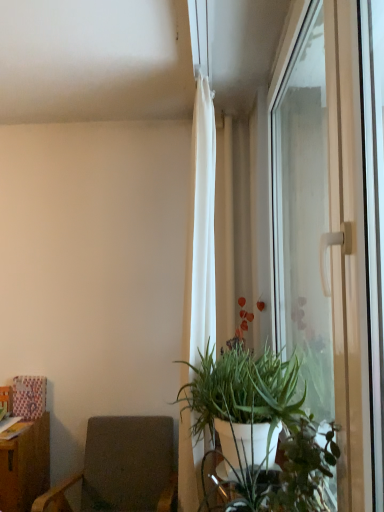
Question: Is dark gray fabric chair at lower left in front of or behind white matte plant pot at lower right in the image?

Choices:
 (A) front
 (B) behind

Answer: (B)

Question: Is point (135, 486) closer or farther from the camera than point (292, 437)?

Choices:
 (A) closer
 (B) farther

Answer: (B)

Question: Considering the real-world distances, which object is farthest from the green matte plant at center?

Choices:
 (A) white sheer curtain at upper center
 (B) dark gray fabric chair at lower left
 (C) white matte plant pot at lower right
 (D) transparent glass window at right

Answer: (B)

Question: Which is nearer to the green matte plant at center?

Choices:
 (A) transparent glass window at right
 (B) dark gray fabric chair at lower left
 (C) white matte plant pot at lower right
 (D) white sheer curtain at upper center

Answer: (C)